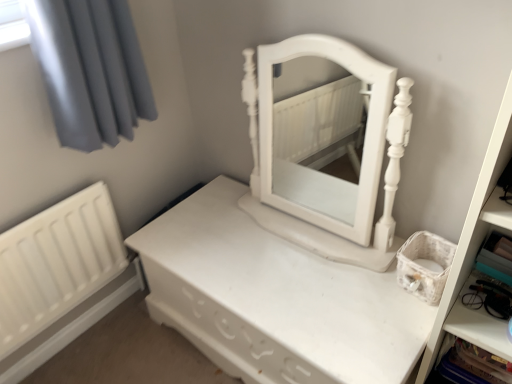
Question: Is white plastic cabinet at lower right in contact with white matte radiator at lower left?

Choices:
 (A) no
 (B) yes

Answer: (A)

Question: Considering the relative positions of white plastic cabinet at lower right and white matte radiator at lower left in the image provided, is white plastic cabinet at lower right behind white matte radiator at lower left?

Choices:
 (A) yes
 (B) no

Answer: (B)

Question: Does white plastic cabinet at lower right have a smaller size compared to white matte radiator at lower left?

Choices:
 (A) no
 (B) yes

Answer: (B)

Question: Does white plastic cabinet at lower right lie in front of white matte radiator at lower left?

Choices:
 (A) yes
 (B) no

Answer: (A)

Question: Considering the relative sizes of white plastic cabinet at lower right and white matte radiator at lower left in the image provided, is white plastic cabinet at lower right taller than white matte radiator at lower left?

Choices:
 (A) no
 (B) yes

Answer: (A)

Question: From a real-world perspective, is white plastic cabinet at lower right under white matte radiator at lower left?

Choices:
 (A) no
 (B) yes

Answer: (B)

Question: Is white matte radiator at lower left aimed at white matte/wooden nightstand at center?

Choices:
 (A) yes
 (B) no

Answer: (A)

Question: Considering the relative sizes of white matte radiator at lower left and white matte/wooden nightstand at center in the image provided, is white matte radiator at lower left taller than white matte/wooden nightstand at center?

Choices:
 (A) no
 (B) yes

Answer: (B)

Question: Is white matte radiator at lower left bigger than white matte/wooden nightstand at center?

Choices:
 (A) no
 (B) yes

Answer: (A)

Question: From the image's perspective, is white matte radiator at lower left above white matte/wooden nightstand at center?

Choices:
 (A) yes
 (B) no

Answer: (A)

Question: From the image's perspective, is white matte radiator at lower left located beneath white matte/wooden nightstand at center?

Choices:
 (A) yes
 (B) no

Answer: (B)

Question: Is white matte radiator at lower left to the right of white matte/wooden nightstand at center from the viewer's perspective?

Choices:
 (A) yes
 (B) no

Answer: (B)

Question: Considering the relative sizes of white matte radiator at lower left and white matte bookshelf at right in the image provided, is white matte radiator at lower left taller than white matte bookshelf at right?

Choices:
 (A) no
 (B) yes

Answer: (A)